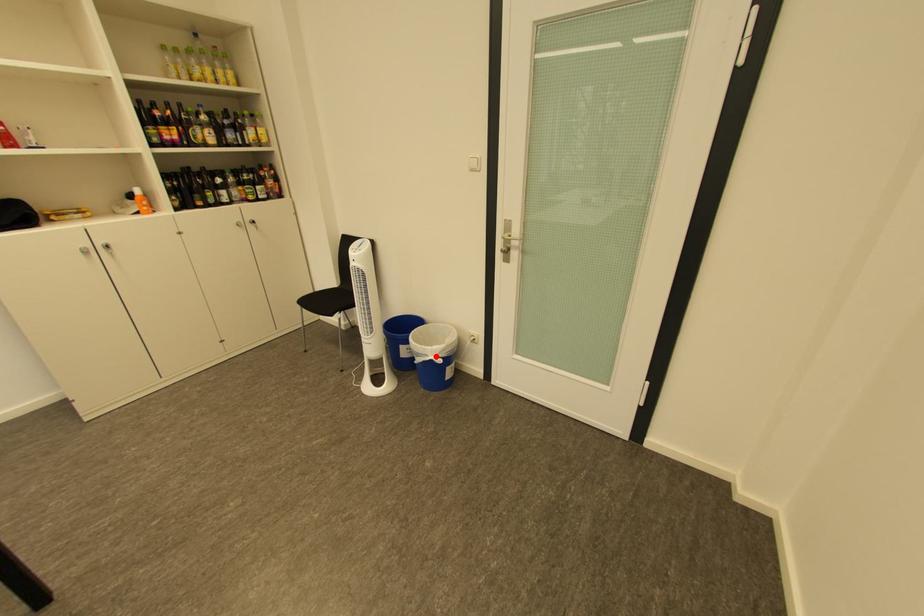
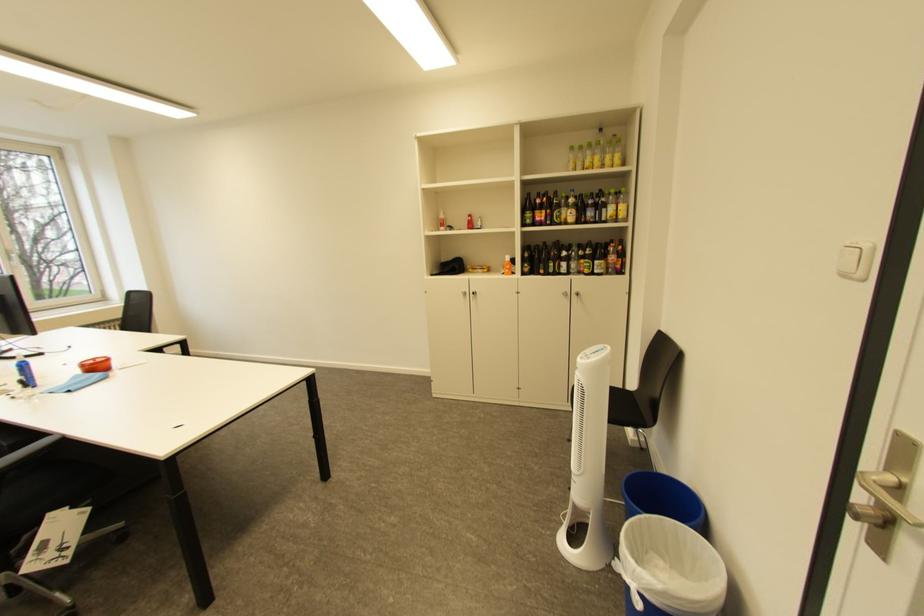
Where in the second image is the point corresponding to the highlighted location from the first image?

(636, 570)